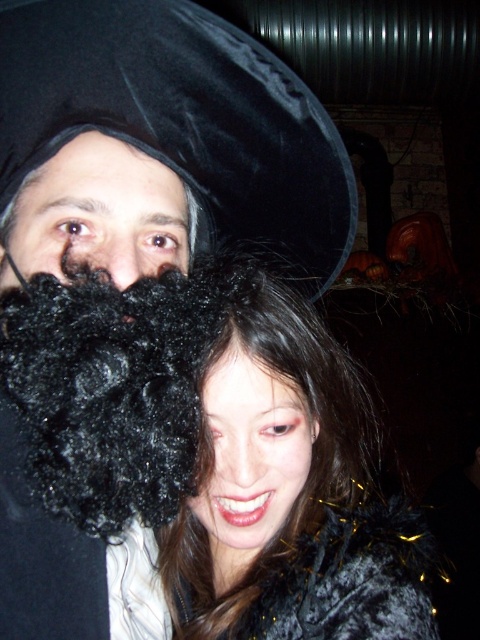
Question: Which is nearer to the matte black hair at center?

Choices:
 (A) black fuzzy wig at center
 (B) black fuzzy mustache at left
 (C) velvet black hat at upper center
 (D) curly black fur at left

Answer: (A)

Question: Can you confirm if black fuzzy wig at center is positioned to the left of curly black fur at left?

Choices:
 (A) yes
 (B) no

Answer: (B)

Question: Which point is farther to the camera?

Choices:
 (A) velvet black hat at upper center
 (B) black fuzzy wig at center
 (C) matte black hair at center

Answer: (C)

Question: Which point is farther from the camera taking this photo?

Choices:
 (A) (206, 352)
 (B) (333, 211)
 (C) (237, 429)
 (D) (303, 467)

Answer: (B)

Question: Can you confirm if black fuzzy mustache at left is positioned to the left of matte black hair at center?

Choices:
 (A) no
 (B) yes

Answer: (B)

Question: Does black fuzzy wig at center appear under matte black hair at center?

Choices:
 (A) yes
 (B) no

Answer: (B)